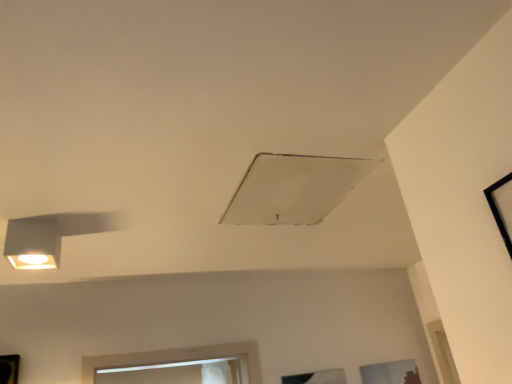
Question: Does matte white lamp at left have a greater height compared to white matte exhaust hood at center?

Choices:
 (A) yes
 (B) no

Answer: (A)

Question: Can we say matte white lamp at left lies outside white matte exhaust hood at center?

Choices:
 (A) no
 (B) yes

Answer: (B)

Question: From a real-world perspective, is matte white lamp at left on white matte exhaust hood at center?

Choices:
 (A) yes
 (B) no

Answer: (B)

Question: From a real-world perspective, is matte white lamp at left under white matte exhaust hood at center?

Choices:
 (A) yes
 (B) no

Answer: (A)

Question: Is matte white lamp at left positioned before white matte exhaust hood at center?

Choices:
 (A) no
 (B) yes

Answer: (A)

Question: Is point (x=342, y=370) positioned closer to the camera than point (x=415, y=379)?

Choices:
 (A) closer
 (B) farther

Answer: (A)

Question: From a real-world perspective, is transparent glass window at lower center, which ranks as the 3th window in right-to-left order, positioned above or below transparent glass window at lower right, which appears as the third window when viewed from the left?

Choices:
 (A) below
 (B) above

Answer: (B)

Question: Considering the positions of transparent glass window at lower center, the second window from the back, and transparent glass window at lower right, the 1th window positioned from the bottom, in the image, is transparent glass window at lower center, the second window from the back, bigger or smaller than transparent glass window at lower right, the 1th window positioned from the bottom,?

Choices:
 (A) small
 (B) big

Answer: (B)

Question: Would you say transparent glass window at lower center, acting as the 2th window starting from the bottom, is inside or outside transparent glass window at lower right, which appears as the third window when viewed from the left?

Choices:
 (A) inside
 (B) outside

Answer: (B)

Question: Considering the positions of black frame at upper right, the second window positioned from the left, and transparent glass window at lower center, which ranks as the 3th window in right-to-left order, in the image, is black frame at upper right, the second window positioned from the left, taller or shorter than transparent glass window at lower center, which ranks as the 3th window in right-to-left order,?

Choices:
 (A) short
 (B) tall

Answer: (B)

Question: Would you say black frame at upper right, the second window positioned from the left, is to the left or to the right of transparent glass window at lower center, acting as the 2th window starting from the bottom, in the picture?

Choices:
 (A) right
 (B) left

Answer: (A)

Question: In terms of size, does black frame at upper right, marked as the 2th window in a right-to-left arrangement, appear bigger or smaller than transparent glass window at lower center, the second window from the back?

Choices:
 (A) small
 (B) big

Answer: (B)

Question: Choose the correct answer: Is black frame at upper right, the 1th window from the front, inside transparent glass window at lower center, placed as the second window when sorted from front to back, or outside it?

Choices:
 (A) inside
 (B) outside

Answer: (B)

Question: From a real-world perspective, is white matte exhaust hood at center positioned above or below transparent glass window at lower right, the 1th window positioned from the bottom?

Choices:
 (A) above
 (B) below

Answer: (A)

Question: Would you say white matte exhaust hood at center is to the left or to the right of transparent glass window at lower right, the third window viewed from the top, in the picture?

Choices:
 (A) left
 (B) right

Answer: (A)